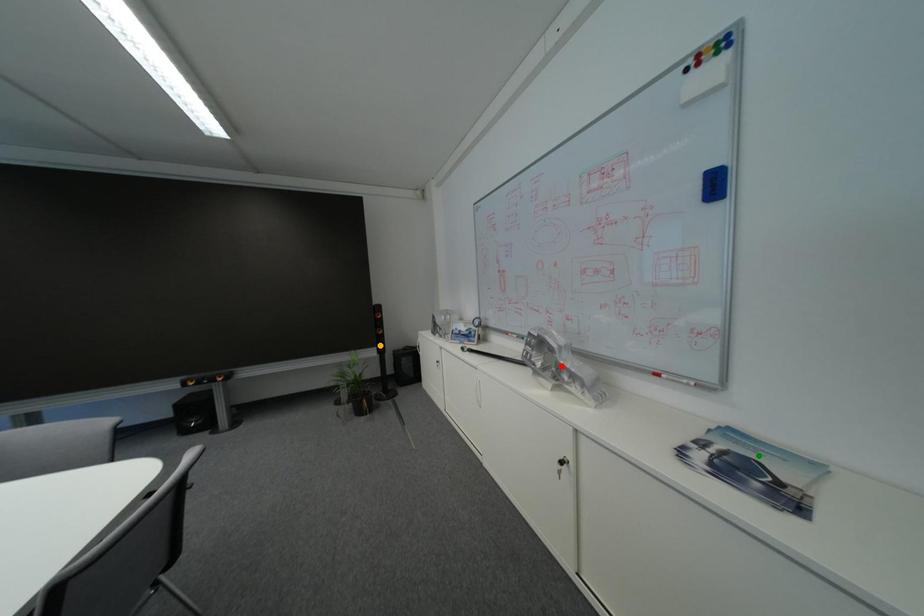
From the picture: Order these from nearest to farthest:
red point | orange point | green point

green point, red point, orange point